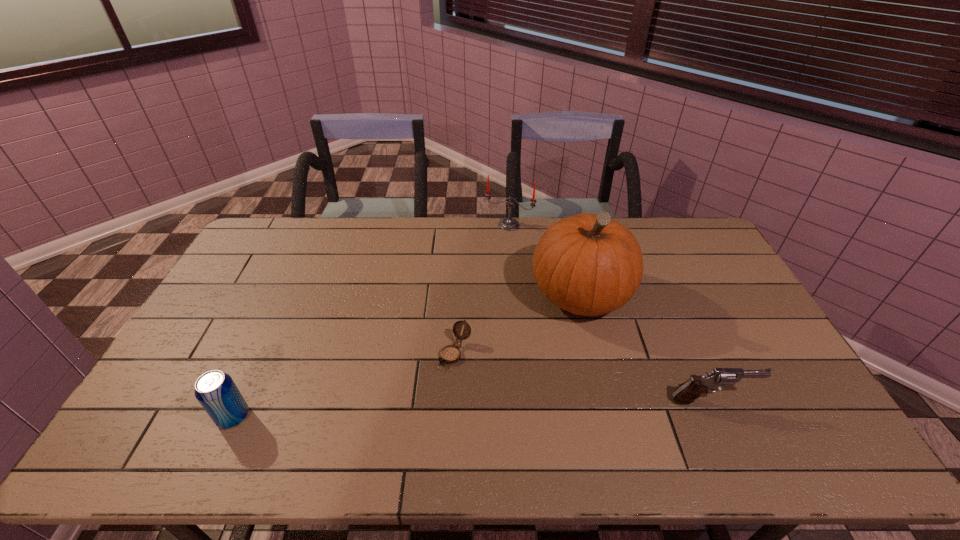
At what (x,y) coordinates should I click in order to perform the action: click on the leftmost object. Please return your answer as a coordinate pair (x, y). Looking at the image, I should click on (215, 390).

Identify the location of pistol. (687, 392).

Locate an element on the screen. This screenshot has height=540, width=960. the farthest object is located at coordinates (509, 224).

Where is `candle`? candle is located at coordinates click(509, 224).

The height and width of the screenshot is (540, 960). In order to click on the fourth nearest object in this screenshot , I will do `click(588, 264)`.

I want to click on the tallest object, so click(x=588, y=264).

The image size is (960, 540). In order to click on compass in this screenshot , I will do `click(450, 354)`.

Identify the location of the fourth object from right to left. (450, 354).

Identify the location of free spot located 0.110m on the right of the beer can. This screenshot has height=540, width=960. [x=293, y=417].

The width and height of the screenshot is (960, 540). Identify the location of vacant area located at the barrel of the rightmost object. (789, 400).